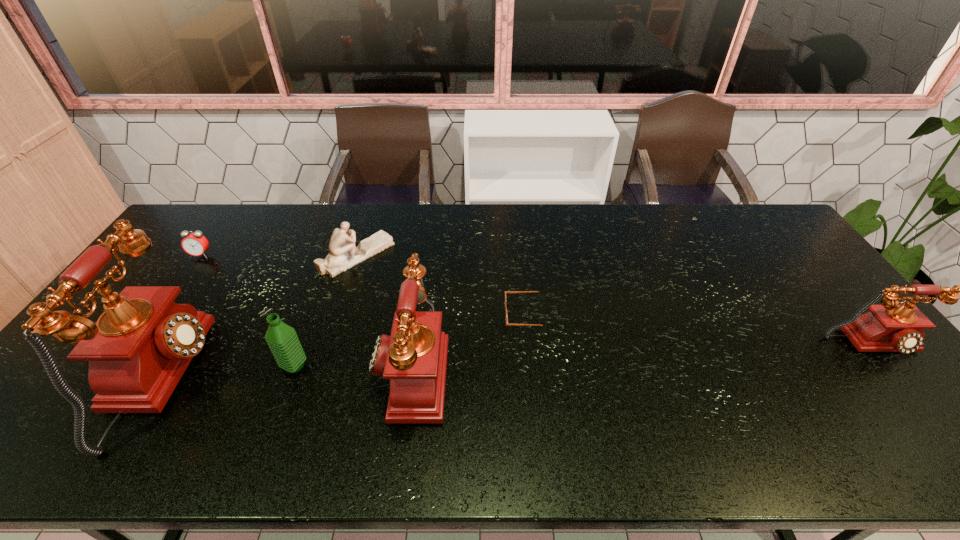
If equal spacing is desired by inserting an extra telephone among them, please point out a free spot for this new telephone. Please provide its 2D coordinates. Your answer should be formatted as a tuple, i.e. [(x, y)], where the tuple contains the x and y coordinates of a point satisfying the conditions above.

[(647, 356)]